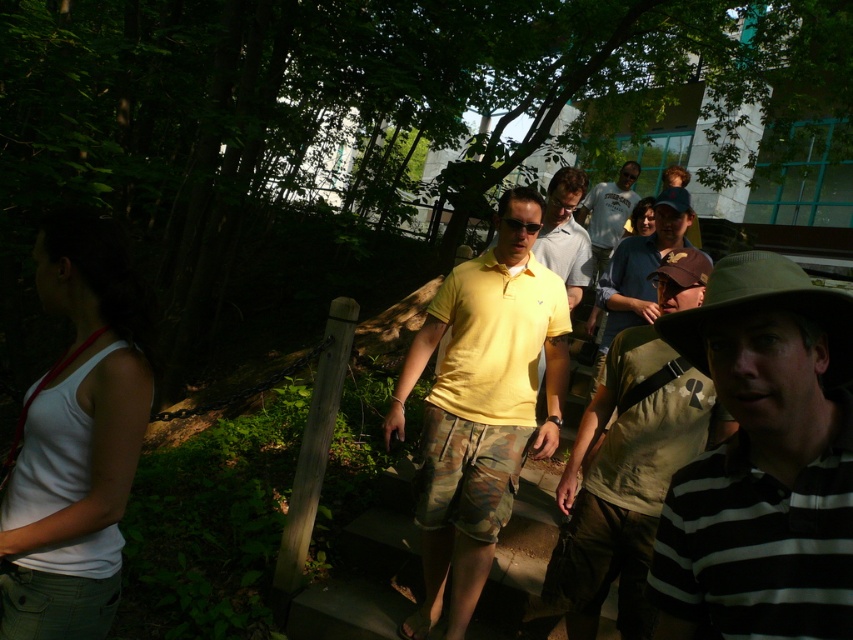
Question: Can you confirm if white fabric tank top at left is bigger than light blue t-shirt at center?

Choices:
 (A) no
 (B) yes

Answer: (A)

Question: Which is farther from the light blue t-shirt at center?

Choices:
 (A) yellow matte shirt at center
 (B) black striped polo shirt at right

Answer: (B)

Question: Based on their relative distances, which object is nearer to the light blue t-shirt at center?

Choices:
 (A) white fabric tank top at left
 (B) yellow matte shirt at center

Answer: (B)

Question: Does black striped polo shirt at right appear on the left side of light blue t-shirt at center?

Choices:
 (A) no
 (B) yes

Answer: (B)

Question: Which point is farther to the camera?

Choices:
 (A) (795, 305)
 (B) (665, 205)
 (C) (581, 209)
 (D) (549, 305)

Answer: (C)

Question: Does black striped polo shirt at right appear on the left side of yellow matte polo shirt at center?

Choices:
 (A) yes
 (B) no

Answer: (B)